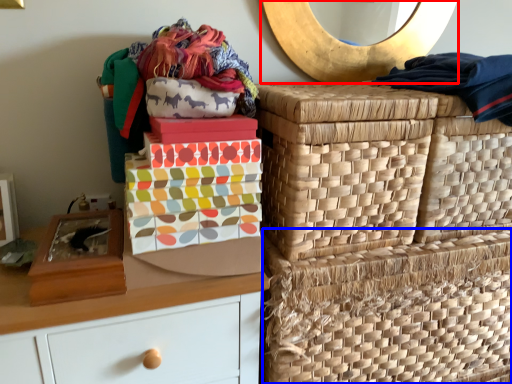
Question: Which object is further to the camera taking this photo, mirror (highlighted by a red box) or basket (highlighted by a blue box)?

Choices:
 (A) mirror
 (B) basket

Answer: (A)